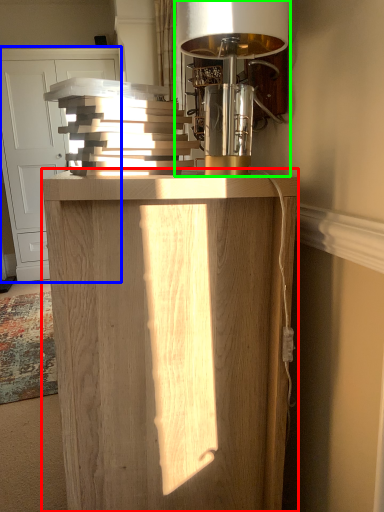
Question: Which object is the closest to the furniture (highlighted by a red box)? Choose among these: cabinetry (highlighted by a blue box) or table lamp (highlighted by a green box).

Choices:
 (A) cabinetry
 (B) table lamp

Answer: (B)